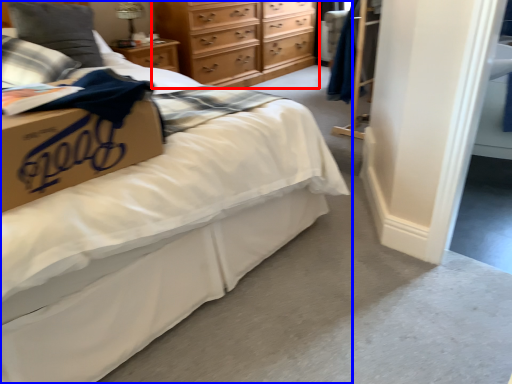
Question: Which object is closer to the camera taking this photo, chest of drawers (highlighted by a red box) or bed (highlighted by a blue box)?

Choices:
 (A) chest of drawers
 (B) bed

Answer: (B)